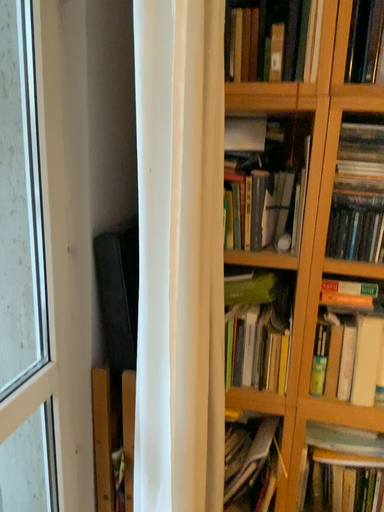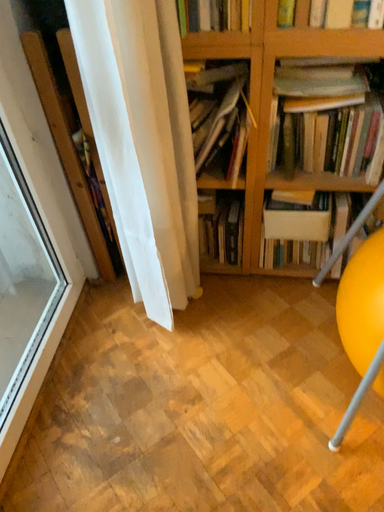
Question: Which way did the camera rotate in the video?

Choices:
 (A) rotated downward
 (B) rotated upward

Answer: (A)